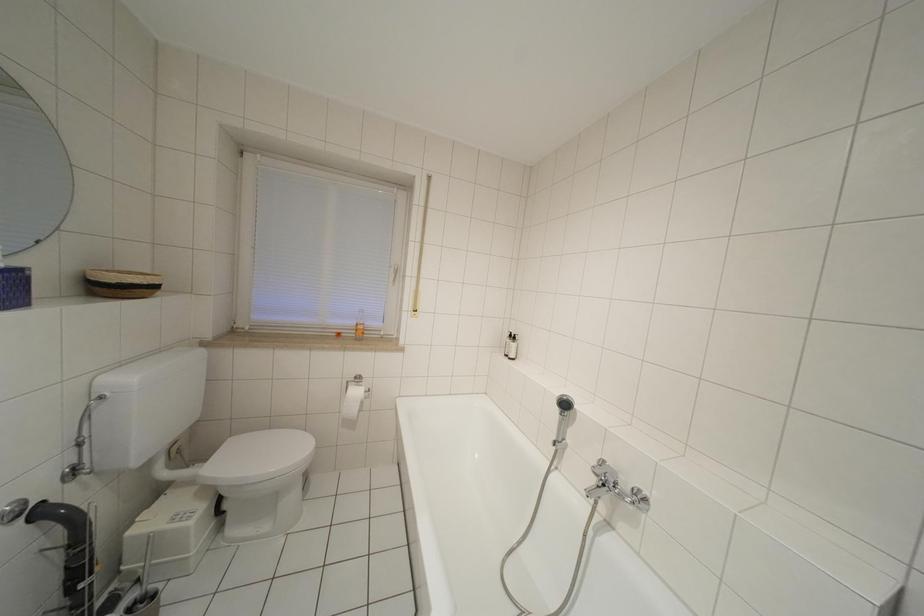
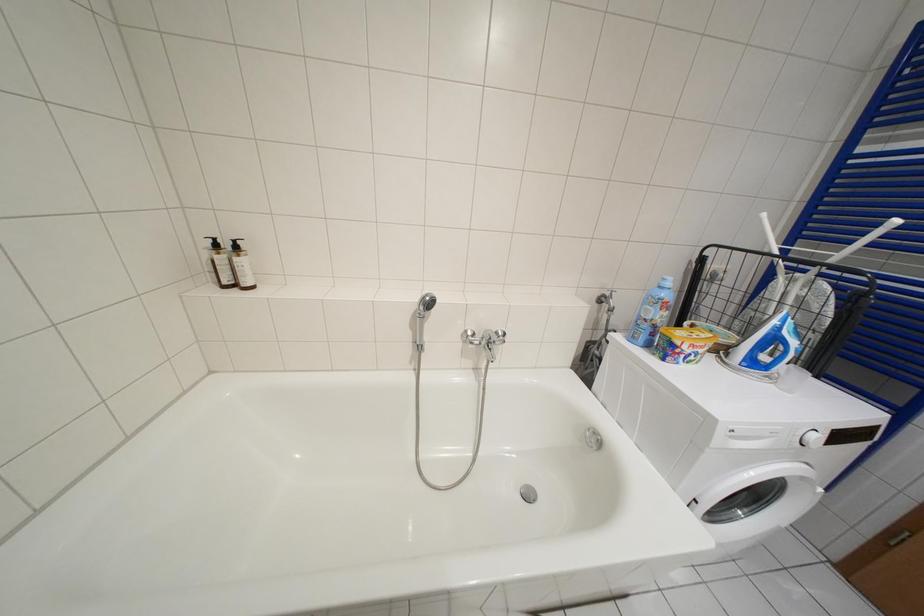
How did the camera likely rotate?

The rotation direction of the camera is right-down.